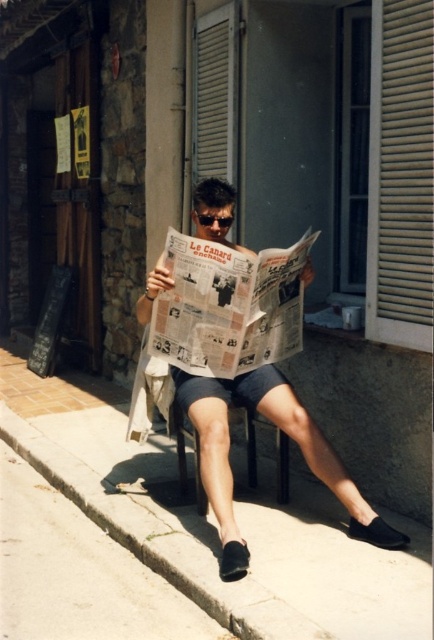
Question: Is concrete at lower center below matte newspaper at center?

Choices:
 (A) no
 (B) yes

Answer: (B)

Question: Among these points, which one is nearest to the camera?

Choices:
 (A) pyautogui.click(x=240, y=579)
 (B) pyautogui.click(x=299, y=438)

Answer: (A)

Question: Which point is closer to the camera?

Choices:
 (A) concrete at lower center
 (B) matte newspaper at center

Answer: (A)

Question: Is concrete at lower center bigger than matte newspaper at center?

Choices:
 (A) yes
 (B) no

Answer: (A)

Question: Which point appears farthest from the camera in this image?

Choices:
 (A) (63, 458)
 (B) (237, 536)

Answer: (A)

Question: Does concrete at lower center have a larger size compared to matte newspaper at center?

Choices:
 (A) no
 (B) yes

Answer: (B)